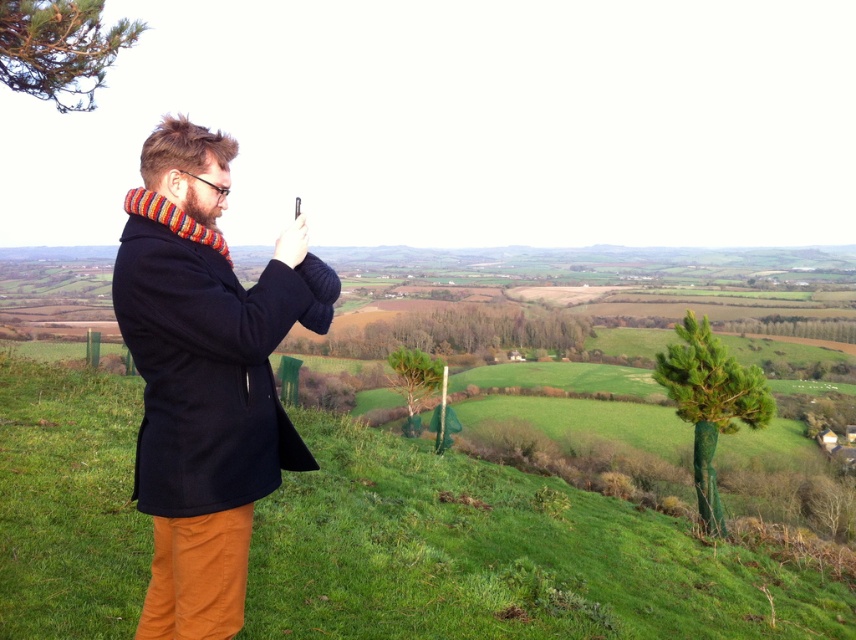
Question: Which of these objects is positioned farthest from the dark blue wool coat at center?

Choices:
 (A) green grassy hillside at center
 (B) green textured pine at center
 (C) green textured pine at right

Answer: (B)

Question: Which point appears closest to the camera in this image?

Choices:
 (A) (691, 403)
 (B) (294, 296)
 (C) (397, 388)
 (D) (419, 512)

Answer: (B)

Question: Does dark blue wool coat at center have a greater width compared to green textured pine at center?

Choices:
 (A) no
 (B) yes

Answer: (A)

Question: Which point is farther to the camera?

Choices:
 (A) (171, 241)
 (B) (411, 378)

Answer: (B)

Question: Is green grassy hillside at center thinner than green textured pine at center?

Choices:
 (A) no
 (B) yes

Answer: (A)

Question: Is the position of green grassy hillside at center less distant than that of green textured pine at center?

Choices:
 (A) no
 (B) yes

Answer: (B)